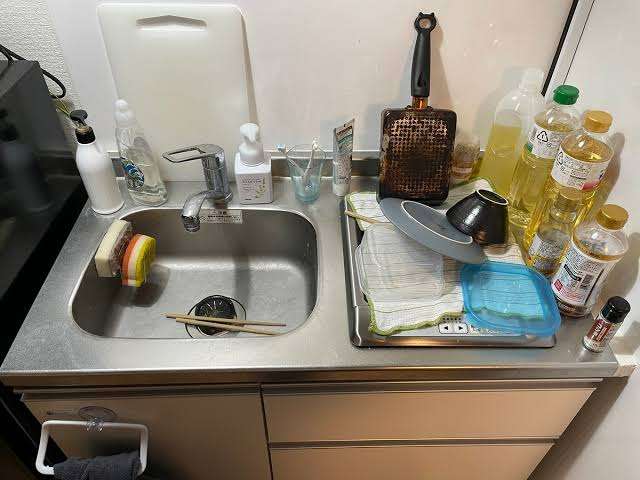
Where is `glass cup`? The image size is (640, 480). glass cup is located at coordinates (305, 186).